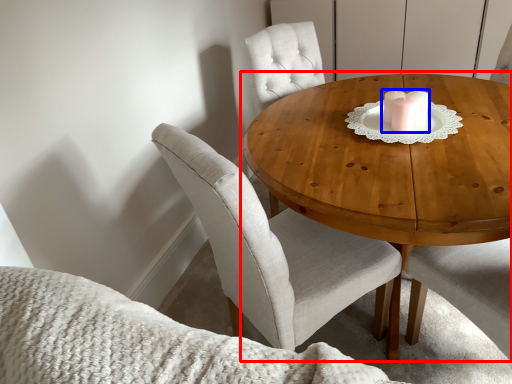
Question: Which of the following is the closest to the observer, coffee table (highlighted by a red box) or candle holder (highlighted by a blue box)?

Choices:
 (A) coffee table
 (B) candle holder

Answer: (A)